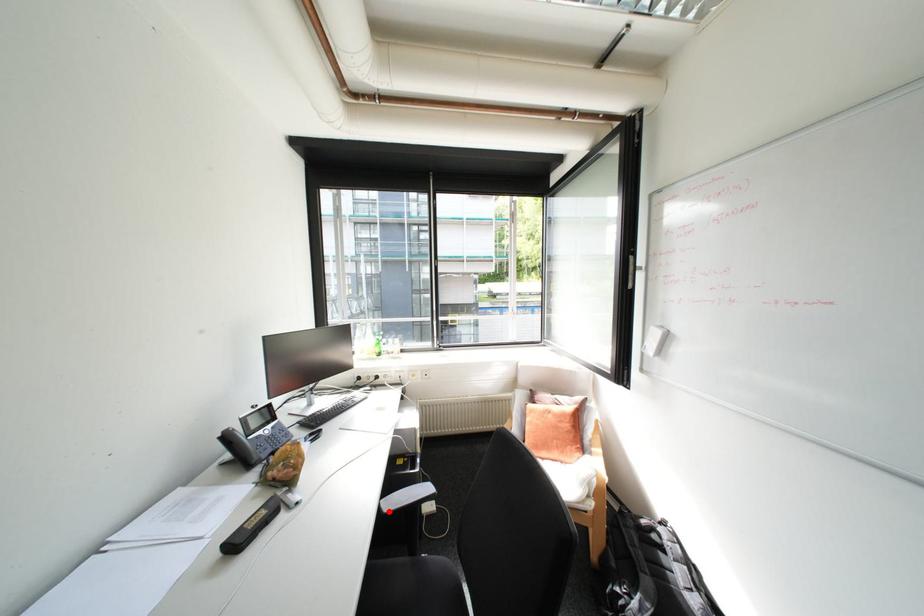
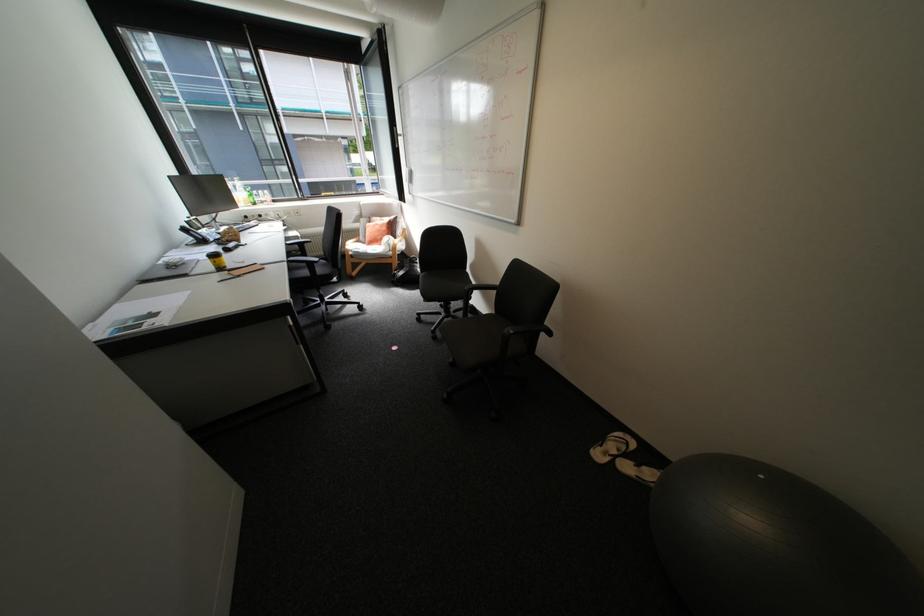
Question: I am providing you with two images of the same scene from different viewpoints. In image1, a red point is highlighted. Considering the same 3D point in image2, which of the following is correct?

Choices:
 (A) It is closer
 (B) It is farther

Answer: (A)